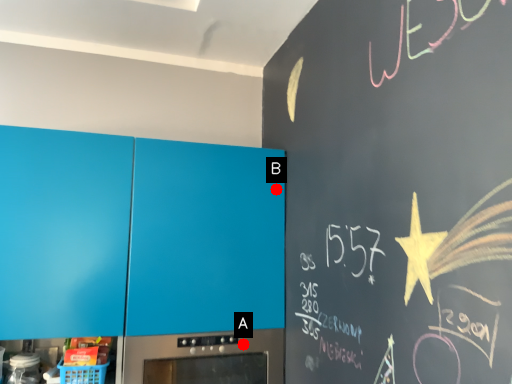
Question: Two points are circled on the image, labeled by A and B beside each circle. Which point is farther to the camera?

Choices:
 (A) A is further
 (B) B is further

Answer: (B)